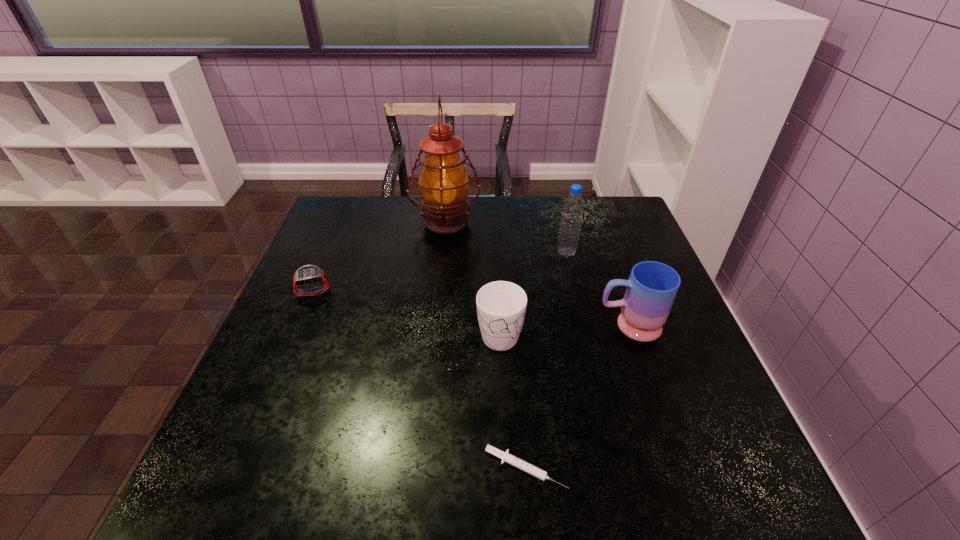
You are a GUI agent. You are given a task and a screenshot of the screen. Output one action in this format:
    pyautogui.click(x=<x>, y=<y>)
    Task: Click on the shortest object
    
    Given the screenshot: What is the action you would take?
    pyautogui.click(x=505, y=456)

Locate an element on the screen. The image size is (960, 540). syringe is located at coordinates (505, 456).

Where is `free space located 0.330m on the right of the oil lamp`? The width and height of the screenshot is (960, 540). free space located 0.330m on the right of the oil lamp is located at coordinates (589, 221).

The width and height of the screenshot is (960, 540). What are the coordinates of `free space located 0.360m on the front of the fifth nearest object` in the screenshot? It's located at (593, 364).

Where is `vacant position located on the side of the taller mug with the handle`? vacant position located on the side of the taller mug with the handle is located at coordinates (544, 326).

Find the location of a particular element. blank space located on the side of the taller mug with the handle is located at coordinates (544, 326).

Locate an element on the screen. The width and height of the screenshot is (960, 540). free space located on the side of the taller mug with the handle is located at coordinates (562, 326).

I want to click on vacant space situated 0.130m on the side of the left mug with the handle, so click(503, 410).

Where is `vacant space located on the back of the fifth tallest object`? The image size is (960, 540). vacant space located on the back of the fifth tallest object is located at coordinates (326, 262).

The width and height of the screenshot is (960, 540). Find the location of `vacant point located on the right of the nearest object`. vacant point located on the right of the nearest object is located at coordinates 726,468.